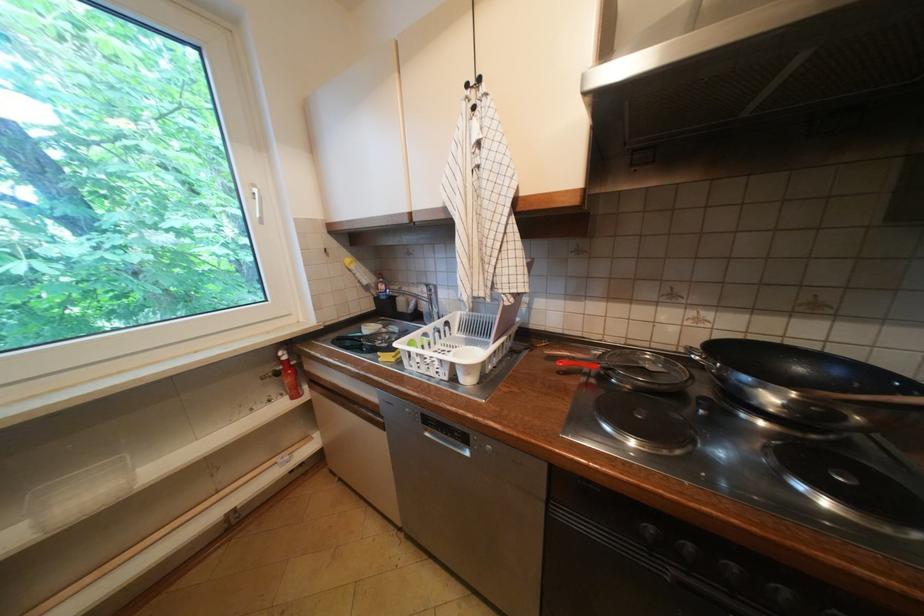
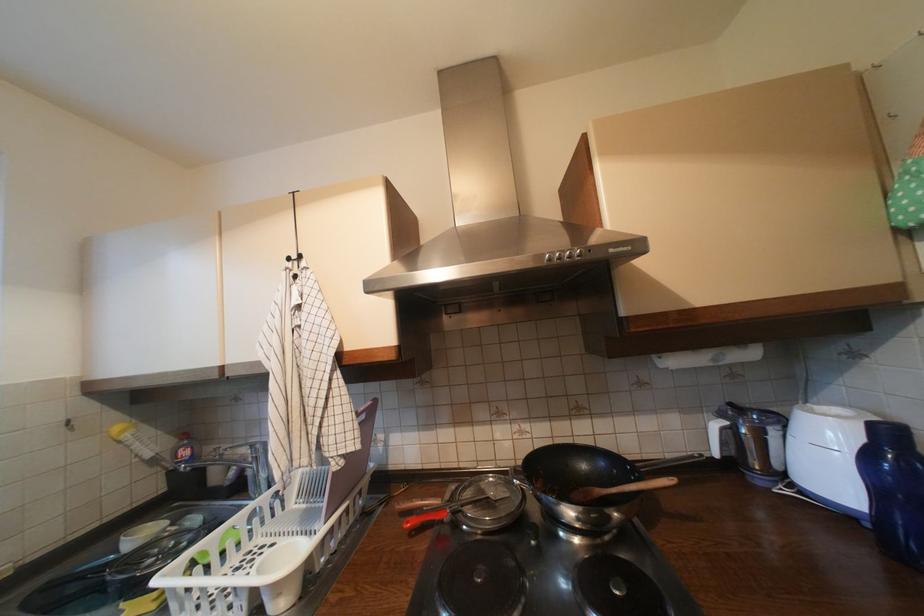
Question: I am providing you with two images of the same scene from different viewpoints. After the viewpoint changes to image2, which objects are now occluded?

Choices:
 (A) paper towel roll
 (B) red soap bottle
 (C) range hood button
 (D) none of these

Answer: (D)